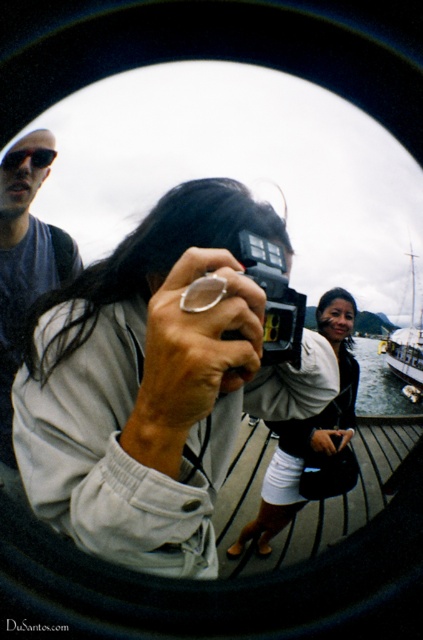
The width and height of the screenshot is (423, 640). What do you see at coordinates (154, 385) in the screenshot? I see `matte black camera at center` at bounding box center [154, 385].

This screenshot has height=640, width=423. In order to click on matte black camera at center in this screenshot , I will do `click(154, 385)`.

Does matte black camera at center have a greater height compared to black plastic camera at center?

Yes, matte black camera at center is taller than black plastic camera at center.

Is matte black camera at center to the left of black plastic camera at center from the viewer's perspective?

Yes, matte black camera at center is to the left of black plastic camera at center.

What are the coordinates of `matte black camera at center` in the screenshot? It's located at (154, 385).

You are a GUI agent. You are given a task and a screenshot of the screen. Output one action in this format:
    pyautogui.click(x=<x>, y=<y>)
    Task: Click on the matte black camera at center
    The height and width of the screenshot is (640, 423).
    Given the screenshot: What is the action you would take?
    pyautogui.click(x=154, y=385)

Which of these two, black plastic camera at center or clear water at dock center, stands shorter?

black plastic camera at center

Which is in front, point (247, 266) or point (412, 412)?

Positioned in front is point (247, 266).

Identify the location of black plastic camera at center. (274, 300).